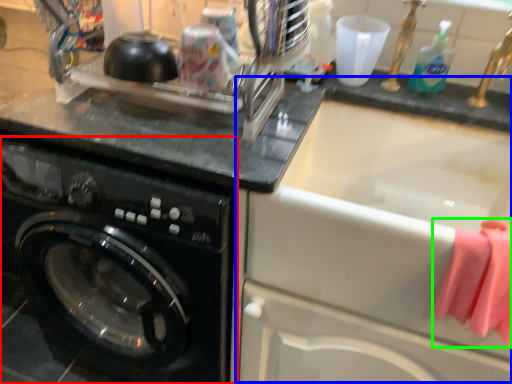
Question: Considering the real-world distances, which object is closest to washing machine (highlighted by a red box)? sink (highlighted by a blue box) or clothe (highlighted by a green box).

Choices:
 (A) sink
 (B) clothe

Answer: (A)